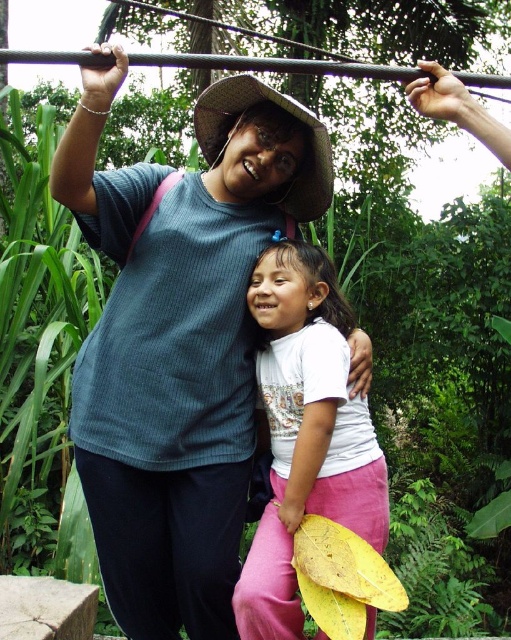
Question: Which point is closer to the camera?

Choices:
 (A) pyautogui.click(x=370, y=541)
 (B) pyautogui.click(x=228, y=304)

Answer: (A)

Question: Does blue ribbed shirt at center appear on the left side of white matte shirt at center?

Choices:
 (A) no
 (B) yes

Answer: (B)

Question: Is blue ribbed shirt at center further to the viewer compared to white matte shirt at center?

Choices:
 (A) no
 (B) yes

Answer: (A)

Question: Is blue ribbed shirt at center further to the viewer compared to white matte shirt at center?

Choices:
 (A) no
 (B) yes

Answer: (A)